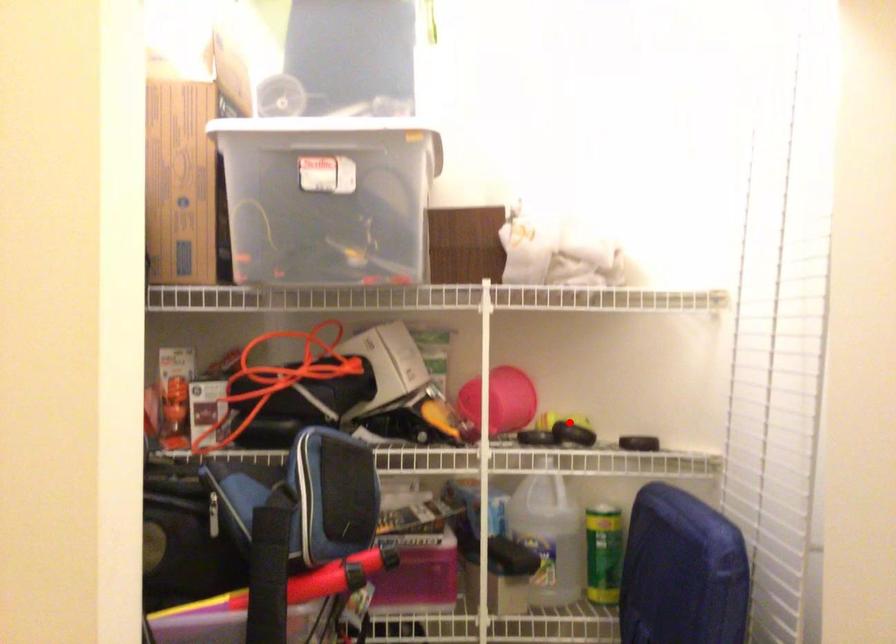
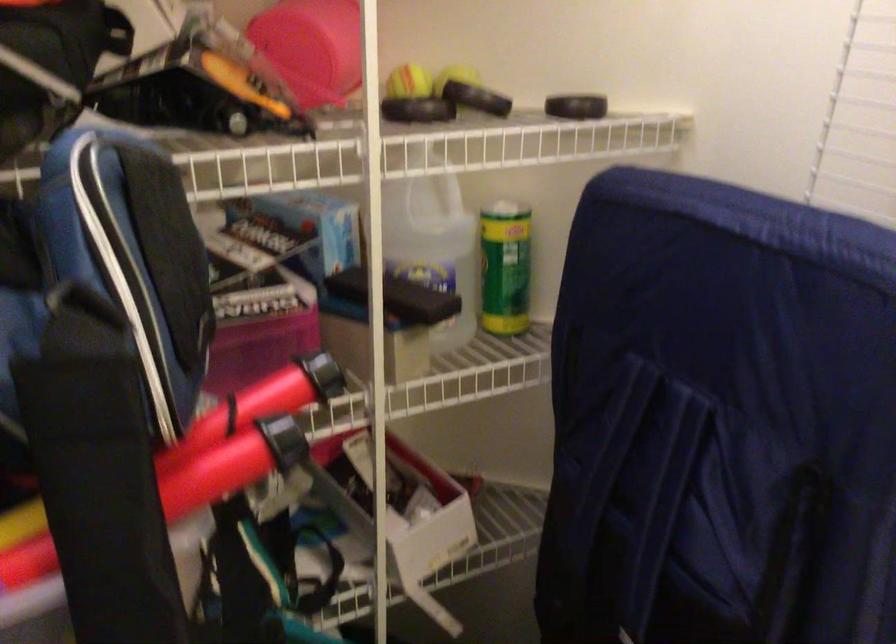
Find the pixel in the second image that matches the highlighted location in the first image.

(457, 76)